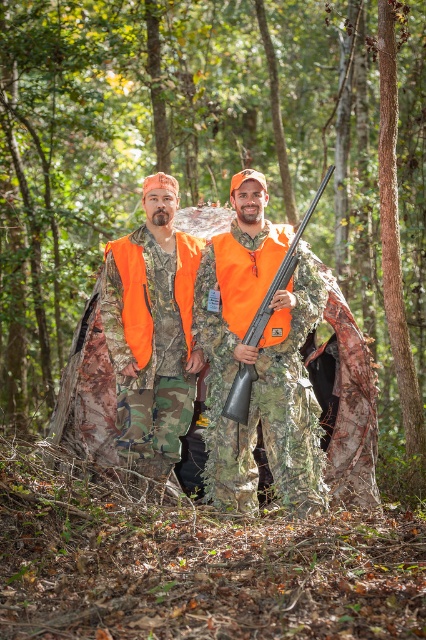
Question: Can you confirm if camouflage fabric jacket at center is thinner than matte orange shotgun at center?

Choices:
 (A) no
 (B) yes

Answer: (A)

Question: Does camouflage fabric hunting gear at center have a lesser width compared to matte orange shotgun at center?

Choices:
 (A) no
 (B) yes

Answer: (A)

Question: Which object is farther from the camera taking this photo?

Choices:
 (A) matte orange shotgun at center
 (B) camouflage fabric jacket at center
 (C) camouflage fabric hunting gear at center

Answer: (B)

Question: Observing the image, what is the correct spatial positioning of camouflage fabric hunting gear at center in reference to camouflage fabric jacket at center?

Choices:
 (A) below
 (B) above

Answer: (B)

Question: Which object appears closest to the camera in this image?

Choices:
 (A) camouflage fabric hunting gear at center
 (B) camouflage fabric jacket at center

Answer: (A)

Question: Which of the following is the closest to the observer?

Choices:
 (A) (239, 413)
 (B) (95, 452)
 (C) (184, 384)

Answer: (A)